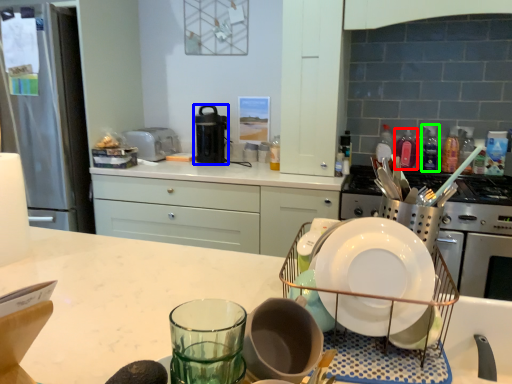
Question: Based on their relative distances, which object is nearer to bottle (highlighted by a red box)? Choose from kitchen appliance (highlighted by a blue box) and bottle (highlighted by a green box).

Choices:
 (A) kitchen appliance
 (B) bottle

Answer: (B)